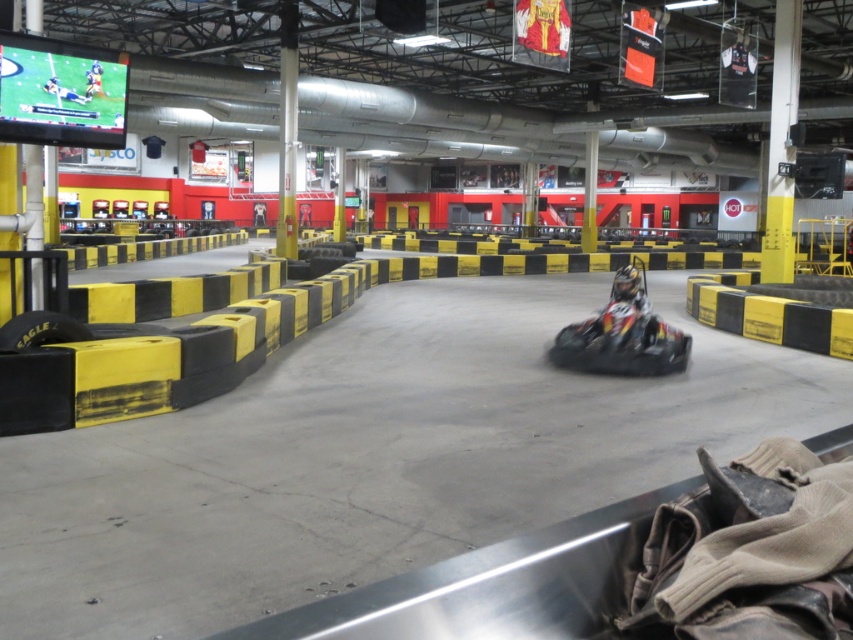
You are a go kart racer who just finished a race and want to retrieve your shiny black helmet at center. The track is 10 meters long. Can you reach your helmet without leaving the track?

The shiny black helmet at center is 8.16 meters from camera. Since the track is 10 meters long, you can reach the shiny black helmet at center without leaving the track as it is within the track length.